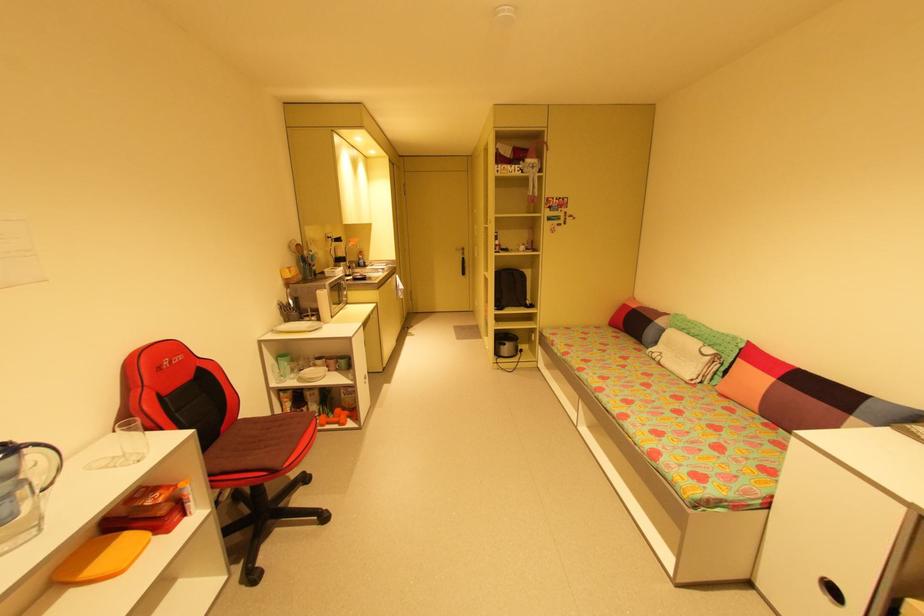
What do you see at coordinates (844, 524) in the screenshot?
I see `the white drawer handle` at bounding box center [844, 524].